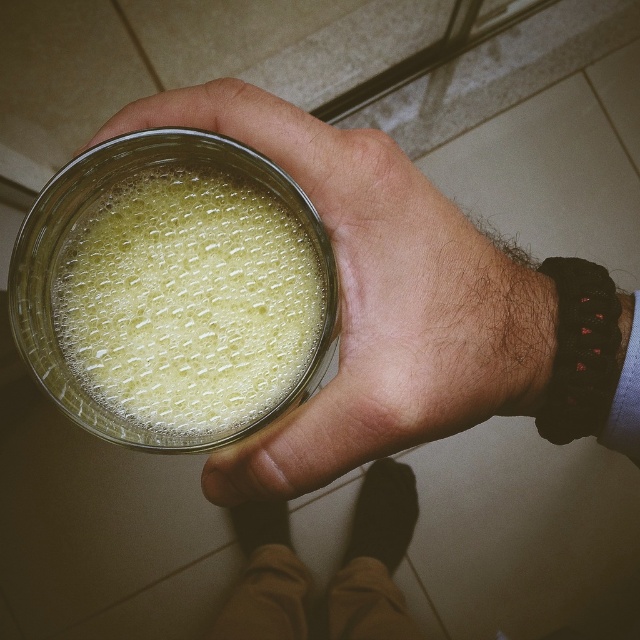
Can you confirm if clear glass jar at center is taller than translucent glass jar at center?

Correct, clear glass jar at center is much taller as translucent glass jar at center.

Is clear glass jar at center below translucent glass jar at center?

Indeed, clear glass jar at center is positioned under translucent glass jar at center.

Where is `clear glass jar at center`? This screenshot has width=640, height=640. clear glass jar at center is located at coordinates (374, 300).